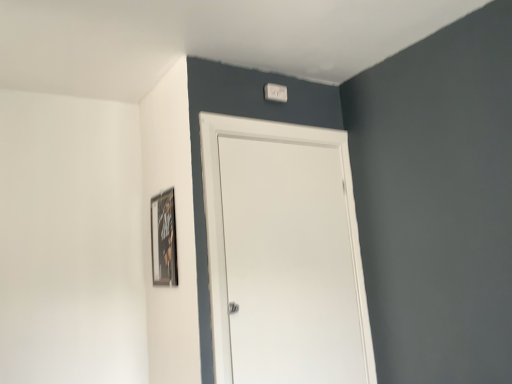
Question: Does white matte door at center appear on the right side of white plastic light switch at upper center?

Choices:
 (A) yes
 (B) no

Answer: (A)

Question: Can you confirm if white matte door at center is thinner than white plastic light switch at upper center?

Choices:
 (A) no
 (B) yes

Answer: (B)

Question: From a real-world perspective, is white matte door at center positioned under white plastic light switch at upper center based on gravity?

Choices:
 (A) no
 (B) yes

Answer: (B)

Question: From a real-world perspective, is white matte door at center located higher than white plastic light switch at upper center?

Choices:
 (A) yes
 (B) no

Answer: (B)

Question: From the image's perspective, is white matte door at center on white plastic light switch at upper center?

Choices:
 (A) yes
 (B) no

Answer: (B)

Question: Considering the positions of white plastic light switch at upper center and white matte door at center in the image, is white plastic light switch at upper center taller or shorter than white matte door at center?

Choices:
 (A) short
 (B) tall

Answer: (A)

Question: Would you say white plastic light switch at upper center is to the left or to the right of white matte door at center in the picture?

Choices:
 (A) right
 (B) left

Answer: (B)

Question: From the image's perspective, is white plastic light switch at upper center above or below white matte door at center?

Choices:
 (A) below
 (B) above

Answer: (B)

Question: Is white plastic light switch at upper center inside the boundaries of white matte door at center, or outside?

Choices:
 (A) outside
 (B) inside

Answer: (A)

Question: From a real-world perspective, is wooden framed poster at upper left physically located above or below white matte door at center?

Choices:
 (A) above
 (B) below

Answer: (A)

Question: Based on their positions, is wooden framed poster at upper left located to the left or right of white matte door at center?

Choices:
 (A) right
 (B) left

Answer: (B)

Question: From the image's perspective, relative to white matte door at center, is wooden framed poster at upper left above or below?

Choices:
 (A) above
 (B) below

Answer: (A)

Question: Considering the positions of wooden framed poster at upper left and white matte door at center in the image, is wooden framed poster at upper left bigger or smaller than white matte door at center?

Choices:
 (A) small
 (B) big

Answer: (A)

Question: Is white plastic light switch at upper center wider or thinner than wooden framed poster at upper left?

Choices:
 (A) wide
 (B) thin

Answer: (A)

Question: Is white plastic light switch at upper center to the left or to the right of wooden framed poster at upper left in the image?

Choices:
 (A) right
 (B) left

Answer: (A)